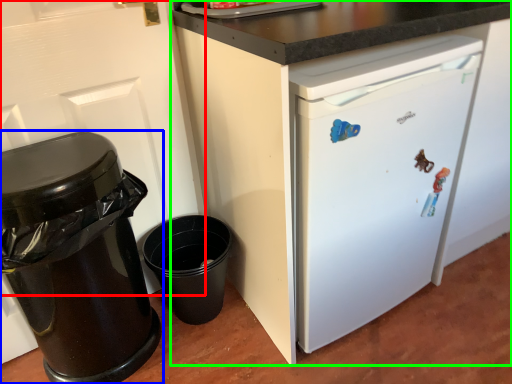
Question: Estimate the real-world distances between objects in this image. Which object is farther from door (highlighted by a red box), waste container (highlighted by a blue box) or cabinetry (highlighted by a green box)?

Choices:
 (A) waste container
 (B) cabinetry

Answer: (B)